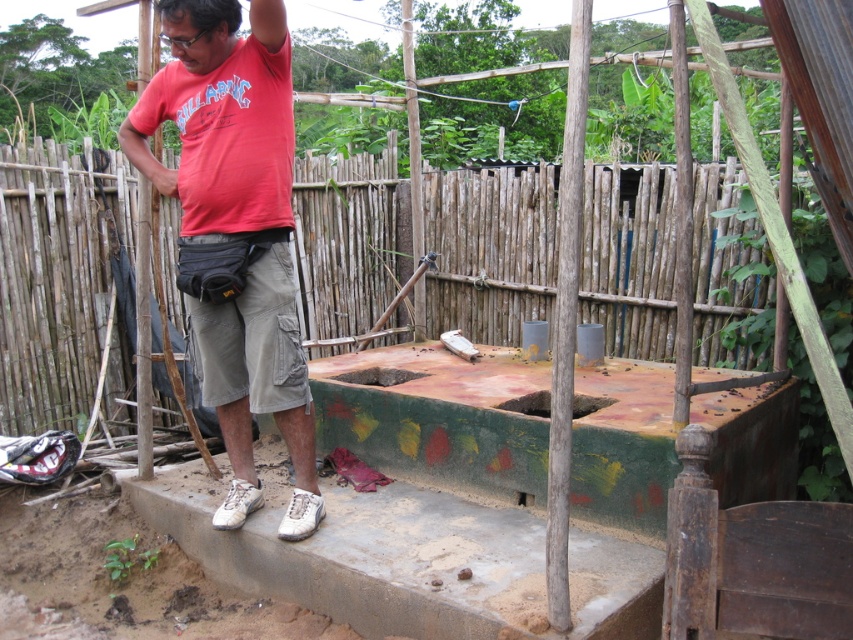
Question: Which object appears closest to the camera in this image?

Choices:
 (A) weathered wood pole at center
 (B) brown wooden pole at left
 (C) white matte sneakers at lower center
 (D) green painted concrete foundation at center

Answer: (A)

Question: Among these points, which one is farthest from the camera?

Choices:
 (A) (144, 396)
 (B) (421, 572)
 (C) (579, 90)
 (D) (250, 387)

Answer: (A)

Question: Which of the following is the farthest from the observer?

Choices:
 (A) (569, 109)
 (B) (263, 593)
 (C) (151, 38)

Answer: (C)

Question: Does green painted concrete foundation at center appear under white matte sneakers at lower center?

Choices:
 (A) yes
 (B) no

Answer: (A)

Question: Does weathered wood pole at center appear on the right side of brown rough wooden pole at center?

Choices:
 (A) yes
 (B) no

Answer: (B)

Question: Can you confirm if white matte sneakers at lower center is wider than brown rough wooden pole at center?

Choices:
 (A) no
 (B) yes

Answer: (B)